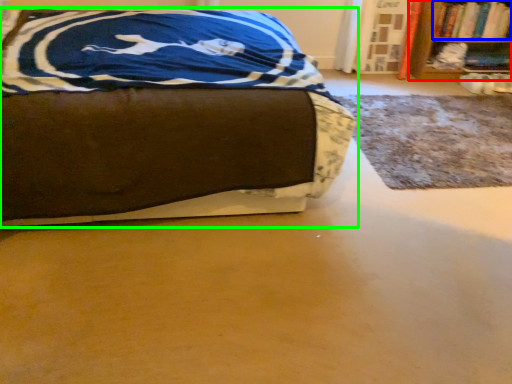
Question: Which object is the closest to the bookcase (highlighted by a red box)? Choose among these: book (highlighted by a blue box) or bed (highlighted by a green box).

Choices:
 (A) book
 (B) bed

Answer: (A)